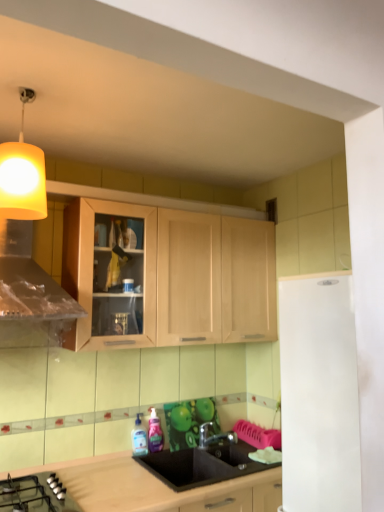
Question: Considering their positions, is transparent plastic bottle at sink, which ranks as the 1th bottle in left-to-right order, located in front of or behind black glass gas stove at lower left?

Choices:
 (A) behind
 (B) front

Answer: (A)

Question: From their relative heights in the image, would you say transparent plastic bottle at sink, which ranks as the 1th bottle in left-to-right order, is taller or shorter than black glass gas stove at lower left?

Choices:
 (A) tall
 (B) short

Answer: (A)

Question: Which object is positioned closest to the white matte refrigerator at right?

Choices:
 (A) metallic silver faucet at lower center
 (B) yellow fabric lampshade at upper left
 (C) transparent plastic bottle at sink, which ranks as the 1th bottle in left-to-right order
 (D) pink glossy bottle at sink, the second bottle in the left-to-right sequence
 (E) black glass gas stove at lower left

Answer: (E)

Question: Which is farther from the white matte refrigerator at right?

Choices:
 (A) metallic silver faucet at lower center
 (B) yellow fabric lampshade at upper left
 (C) pink glossy bottle at sink, marked as the first bottle in a right-to-left arrangement
 (D) black matte sink at center
 (E) black glass gas stove at lower left

Answer: (C)